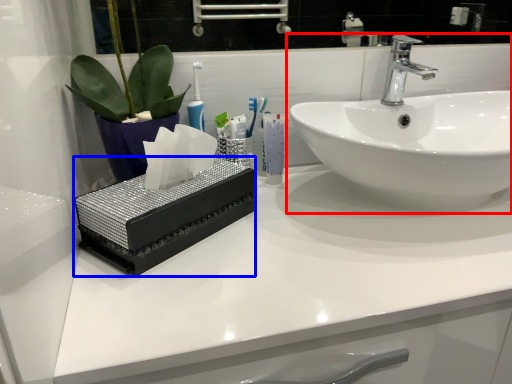
Question: Among these objects, which one is farthest to the camera, sink (highlighted by a red box) or box (highlighted by a blue box)?

Choices:
 (A) sink
 (B) box

Answer: (A)